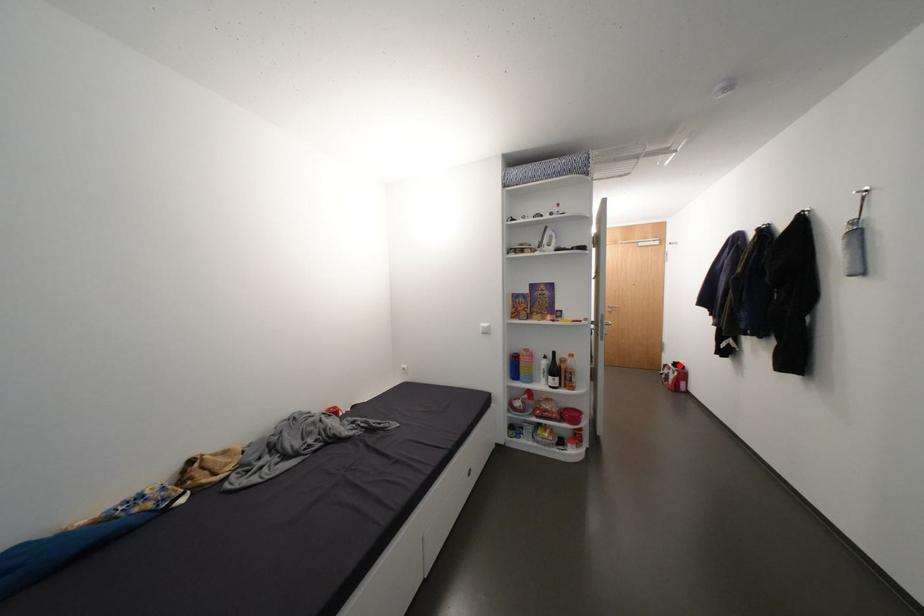
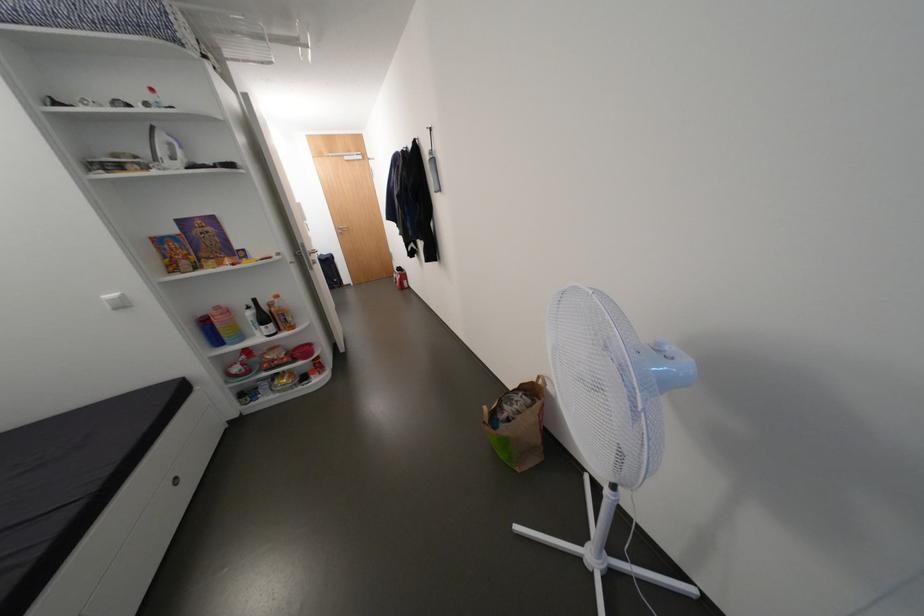
Question: A red point is marked in image1. In image2, is the corresponding 3D point closer to the camera or farther? Reply with the corresponding letter.

Choices:
 (A) The corresponding 3D point is closer.
 (B) The corresponding 3D point is farther.

Answer: (A)